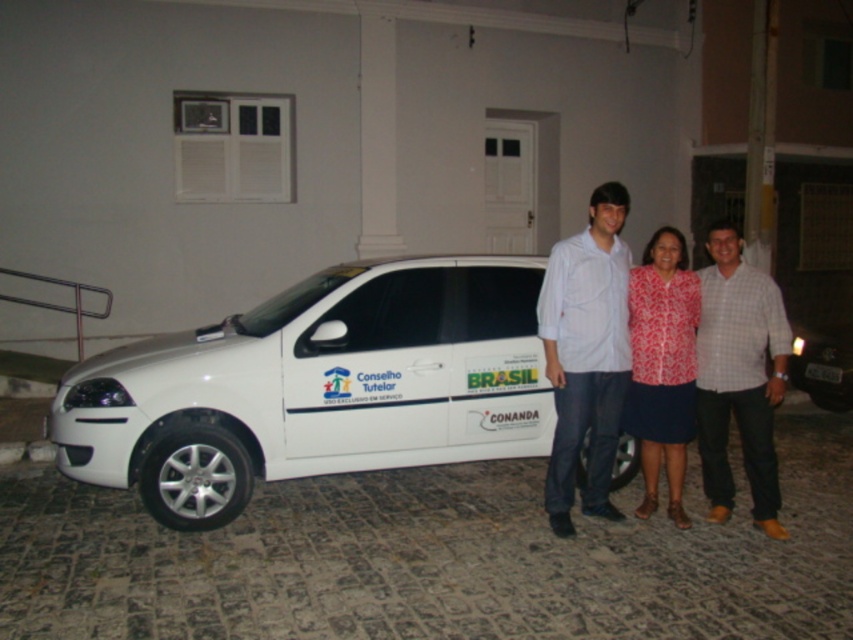
You are a photographer setting up a camera to take a group photo of the white matte car at center and the white checkered shirt at center. You want to ensure both subjects are fully visible in the frame. Based on their sizes, which subject might require more space in the composition?

The white matte car at center might be wider than the white checkered shirt at center, so it might require more space in the composition to ensure it is fully visible.

You are a photographer taking a picture of the two individuals wearing the patterned fabric dress at center and the patterned fabric blouse at center. Which one will be more visible in the photo?

The patterned fabric dress at center is more visible in the photo because it is in front of the patterned fabric blouse at center.

You are a photographer trying to capture a group photo of the white cotton shirt at center and the white glossy sedan at right. Since you want to ensure both are in focus, you need to know which object is narrower. Which one is narrower?

The white cotton shirt at center is narrower than the white glossy sedan at right, so you should focus on the white cotton shirt at center first as it is narrower.